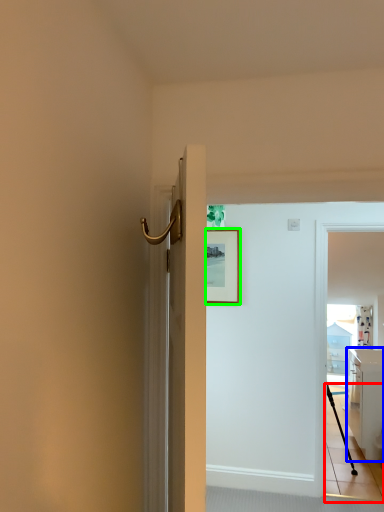
Question: Considering the real-world distances, which object is farthest from path (highlighted by a red box)? cabinetry (highlighted by a blue box) or picture frame (highlighted by a green box)?

Choices:
 (A) cabinetry
 (B) picture frame

Answer: (B)